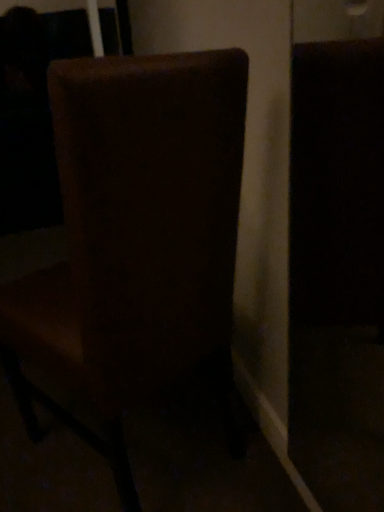
What do you see at coordinates (135, 239) in the screenshot?
I see `brown fabric chair at center` at bounding box center [135, 239].

Locate an element on the screen. brown fabric chair at center is located at coordinates (135, 239).

At what (x,y) coordinates should I click in order to perform the action: click on brown fabric chair at center. Please return your answer as a coordinate pair (x, y). The width and height of the screenshot is (384, 512). Looking at the image, I should click on (135, 239).